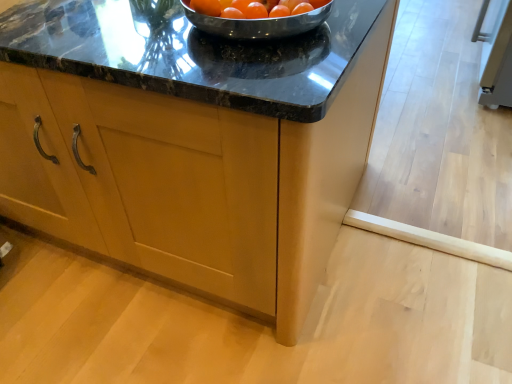
The image size is (512, 384). Find the location of `spots to the right of matte wood cabinet at center`. spots to the right of matte wood cabinet at center is located at coordinates (424, 198).